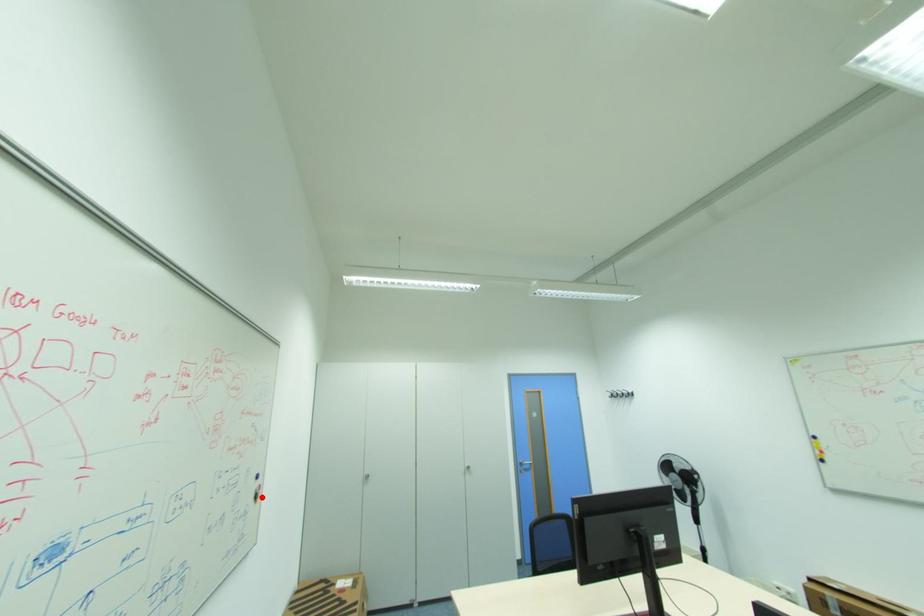
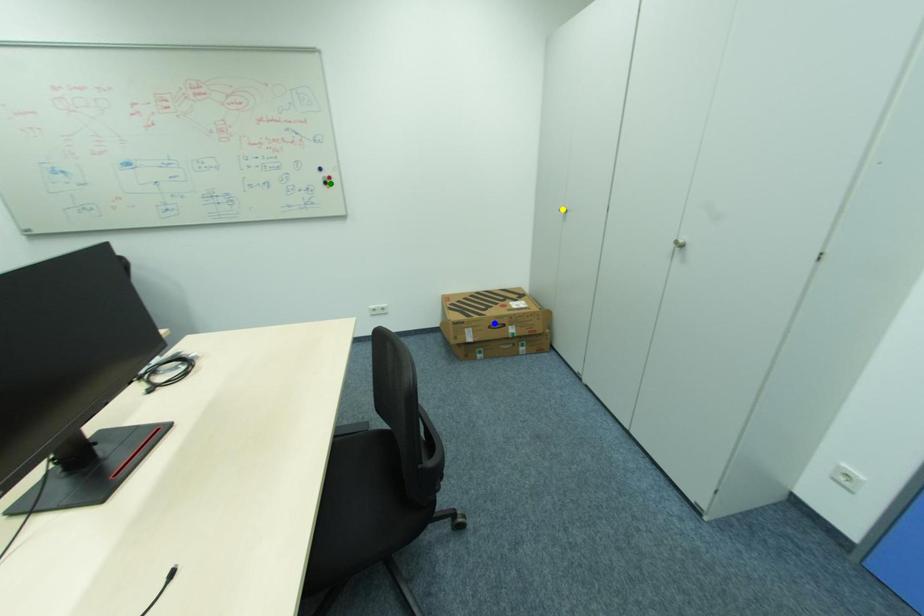
Question: I am providing you with two images of the same scene from different viewpoints. A red point is marked on the first image. You are given multiple points on the second image. Can you choose the point in image 2 that corresponds to the point in image 1?

Choices:
 (A) yellow point
 (B) blue point
 (C) green point

Answer: (C)